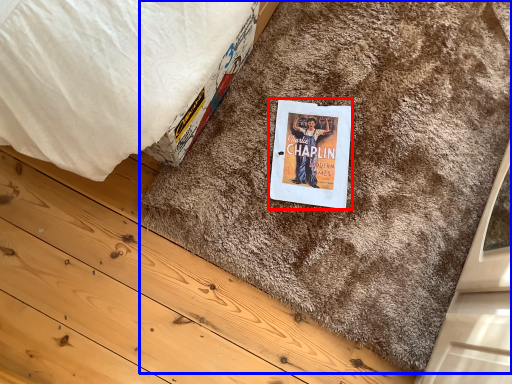
Question: Which of the following is the closest to the observer, paperback book (highlighted by a red box) or doormat (highlighted by a blue box)?

Choices:
 (A) paperback book
 (B) doormat

Answer: (B)